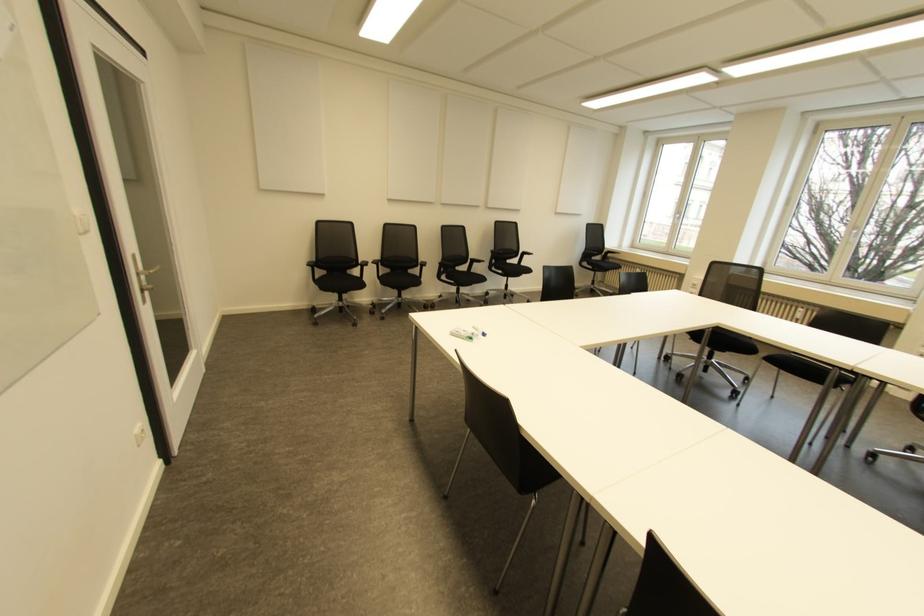
The width and height of the screenshot is (924, 616). I want to click on small plastic box, so click(x=468, y=333).